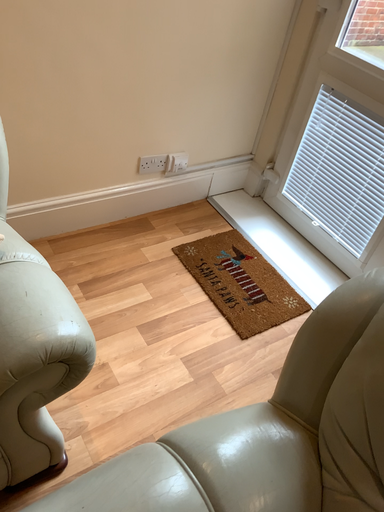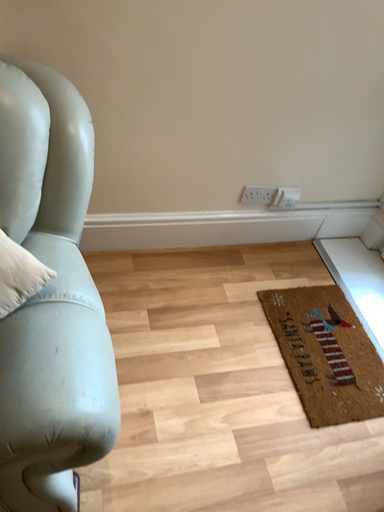
Question: Which way did the camera rotate in the video?

Choices:
 (A) rotated right
 (B) rotated left

Answer: (B)